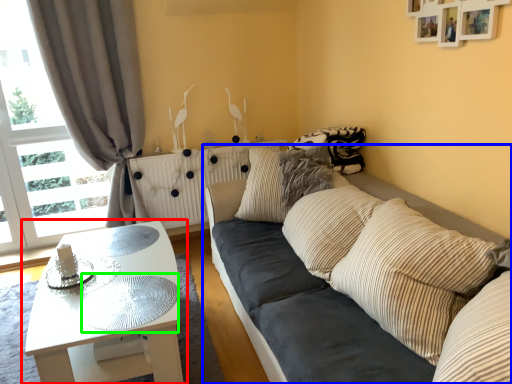
Question: Estimate the real-world distances between objects in this image. Which object is farther from coffee table (highlighted by a red box), studio couch (highlighted by a blue box) or glass table (highlighted by a green box)?

Choices:
 (A) studio couch
 (B) glass table

Answer: (A)